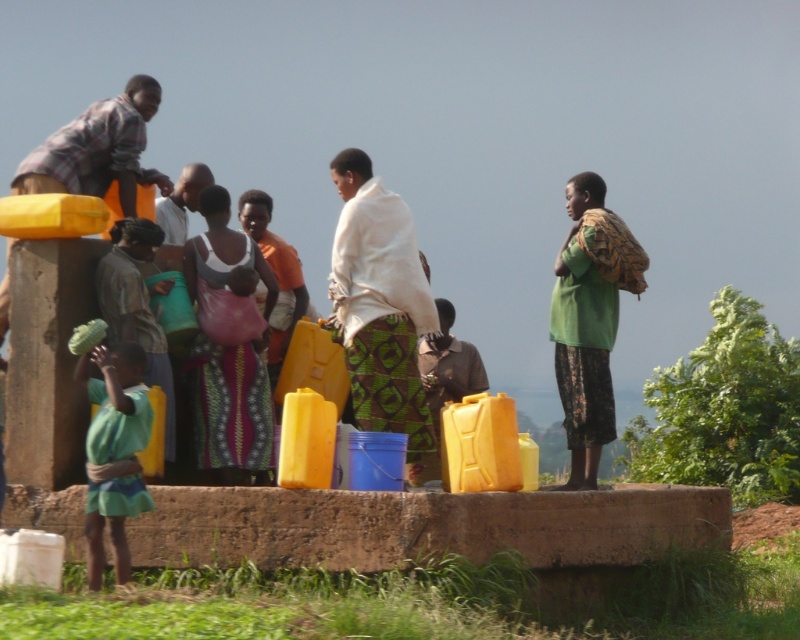
Can you confirm if patterned fabric dress at center is positioned to the right of green fabric shirt at lower left?

Correct, you'll find patterned fabric dress at center to the right of green fabric shirt at lower left.

Is patterned fabric dress at center positioned at the back of green fabric shirt at lower left?

That is True.

The width and height of the screenshot is (800, 640). Find the location of `patterned fabric dress at center`. patterned fabric dress at center is located at coordinates (228, 344).